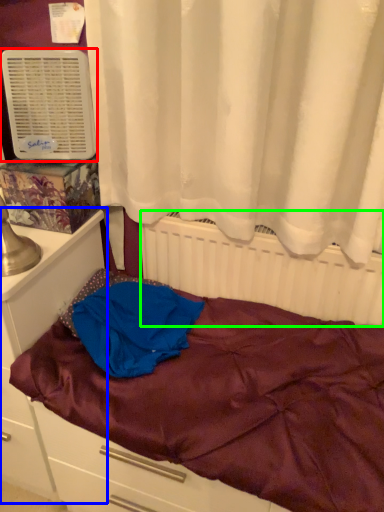
Question: Based on their relative distances, which object is farther from air conditioning (highlighted by a red box)? Choose from file cabinet (highlighted by a blue box) and radiator (highlighted by a green box).

Choices:
 (A) file cabinet
 (B) radiator

Answer: (B)